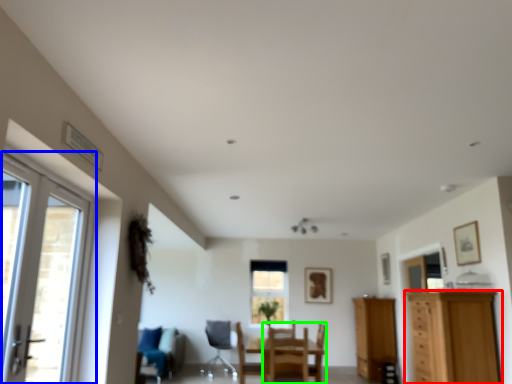
Question: Based on their relative distances, which object is farther from cabinetry (highlighted by a red box)? Choose from door (highlighted by a blue box) and chair (highlighted by a green box).

Choices:
 (A) door
 (B) chair

Answer: (A)